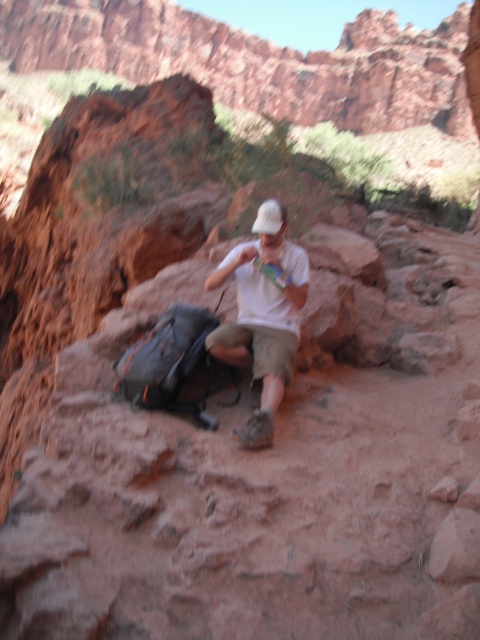
Is white cotton shirt at center positioned behind white matte baseball hat at center?

No, it is not.

Can you confirm if white cotton shirt at center is positioned below white matte baseball hat at center?

Indeed, white cotton shirt at center is positioned under white matte baseball hat at center.

What do you see at coordinates (263, 316) in the screenshot? I see `white cotton shirt at center` at bounding box center [263, 316].

Where is `white cotton shirt at center`? The image size is (480, 640). white cotton shirt at center is located at coordinates (263, 316).